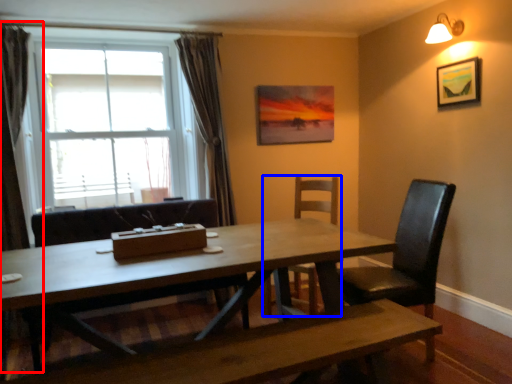
Question: Which of the following is the farthest to the observer, curtain (highlighted by a red box) or chair (highlighted by a blue box)?

Choices:
 (A) curtain
 (B) chair

Answer: (B)